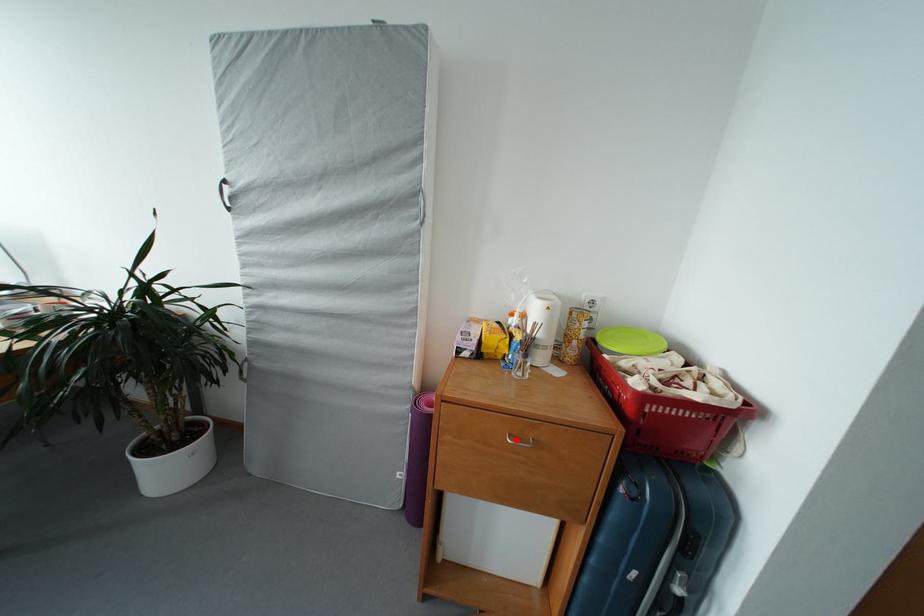
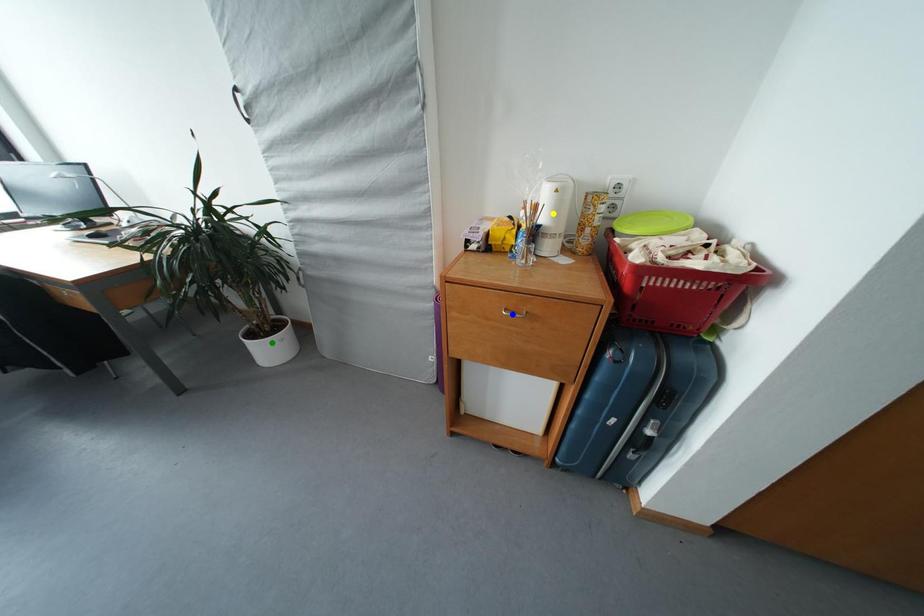
Question: I am providing you with two images of the same scene from different viewpoints. A red point is marked on the first image. You are given multiple points on the second image. In image 2, which mark is for the same physical point as the one in image 1?

Choices:
 (A) blue point
 (B) green point
 (C) yellow point

Answer: (A)